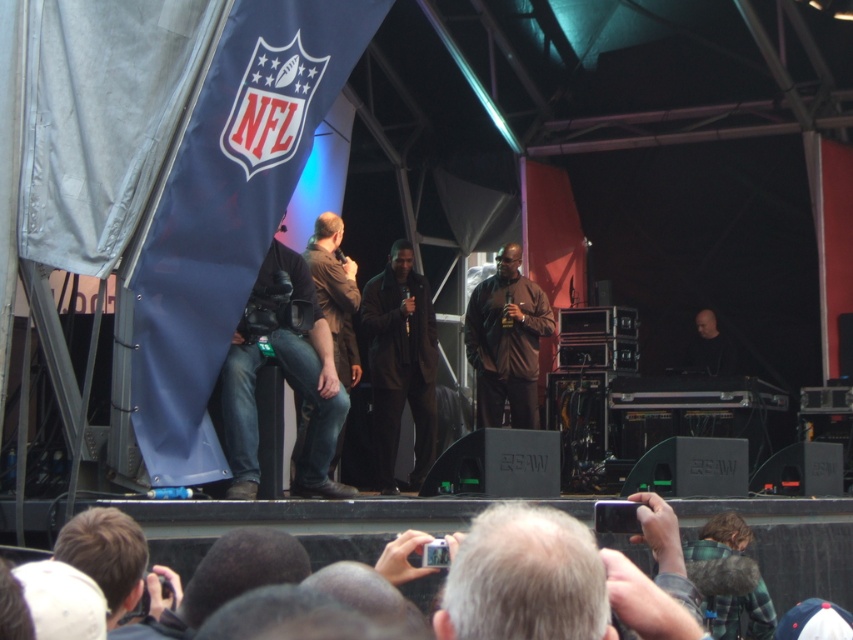
Question: Observing the image, what is the correct spatial positioning of brown matte jacket at center in reference to brown leather jacket at center?

Choices:
 (A) right
 (B) left

Answer: (A)

Question: Which point is closer to the camera taking this photo?

Choices:
 (A) (483, 388)
 (B) (352, 305)
 (C) (317, 394)

Answer: (C)

Question: Considering the real-world distances, which object is farthest from the dark brown leather jacket at center?

Choices:
 (A) black leather jacket at center
 (B) brown leather jacket at center

Answer: (A)

Question: Does black leather jacket at center lie in front of brown leather jacket at center?

Choices:
 (A) yes
 (B) no

Answer: (A)

Question: Which of these objects is positioned closest to the dark brown leather jacket at center?

Choices:
 (A) black leather jacket at center
 (B) brown leather jacket at center

Answer: (B)

Question: Can you confirm if black leather jacket at center is wider than brown leather jacket at center?

Choices:
 (A) no
 (B) yes

Answer: (B)